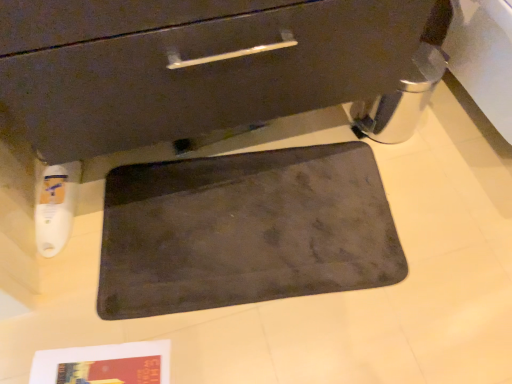
Question: Do you think dark gray matte bath mat at center is within matte black drawer at center, or outside of it?

Choices:
 (A) inside
 (B) outside

Answer: (B)

Question: In terms of size, does dark gray matte bath mat at center appear bigger or smaller than matte black drawer at center?

Choices:
 (A) small
 (B) big

Answer: (A)

Question: From a real-world perspective, is dark gray matte bath mat at center above or below matte black drawer at center?

Choices:
 (A) above
 (B) below

Answer: (B)

Question: From a real-world perspective, is matte black drawer at center positioned above or below dark gray matte bath mat at center?

Choices:
 (A) above
 (B) below

Answer: (A)

Question: Based on their positions, is matte black drawer at center located to the left or right of dark gray matte bath mat at center?

Choices:
 (A) right
 (B) left

Answer: (B)

Question: Is point (84, 57) closer or farther from the camera than point (111, 273)?

Choices:
 (A) farther
 (B) closer

Answer: (B)

Question: From the image's perspective, is matte black drawer at center positioned above or below dark gray matte bath mat at center?

Choices:
 (A) above
 (B) below

Answer: (A)